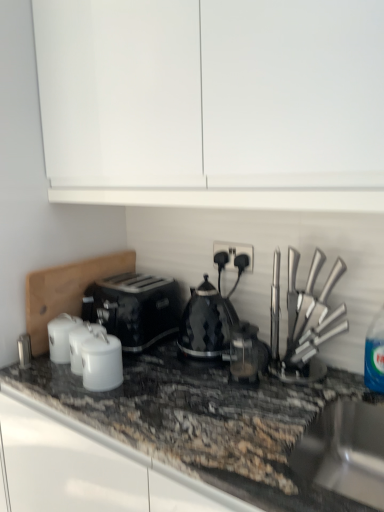
Question: Is satin black coffee machine at center located within white glossy canisters at center, the 1th kitchen appliance in the left-to-right sequence?

Choices:
 (A) no
 (B) yes

Answer: (A)

Question: Is white glossy canisters at center, the 1th kitchen appliance in the left-to-right sequence, oriented away from satin black coffee machine at center?

Choices:
 (A) yes
 (B) no

Answer: (B)

Question: Is white glossy canisters at center, the 1th kitchen appliance in the left-to-right sequence, aimed at satin black coffee machine at center?

Choices:
 (A) yes
 (B) no

Answer: (B)

Question: Is there a large distance between white glossy canisters at center, the 1th kitchen appliance in the left-to-right sequence, and satin black coffee machine at center?

Choices:
 (A) yes
 (B) no

Answer: (B)

Question: Does white glossy canisters at center, the 1th kitchen appliance in the left-to-right sequence, have a smaller size compared to satin black coffee machine at center?

Choices:
 (A) yes
 (B) no

Answer: (A)

Question: From a real-world perspective, is white glossy canister at center, which is the second kitchen appliance from left to right, above or below black plastic socket at center?

Choices:
 (A) above
 (B) below

Answer: (B)

Question: Is white glossy canister at center, which is the second kitchen appliance from left to right, wider or thinner than black plastic socket at center?

Choices:
 (A) wide
 (B) thin

Answer: (A)

Question: From the image's perspective, relative to black plastic socket at center, is white glossy canister at center, which appears as the third kitchen appliance when viewed from the right, above or below?

Choices:
 (A) below
 (B) above

Answer: (A)

Question: Considering the positions of white glossy canister at center, which is the second kitchen appliance from left to right, and black plastic socket at center in the image, is white glossy canister at center, which is the second kitchen appliance from left to right, bigger or smaller than black plastic socket at center?

Choices:
 (A) big
 (B) small

Answer: (A)

Question: In the image, is blue plastic bottle at right on the left side or the right side of stainless steel sink at lower right?

Choices:
 (A) left
 (B) right

Answer: (B)

Question: From a real-world perspective, is blue plastic bottle at right positioned above or below stainless steel sink at lower right?

Choices:
 (A) above
 (B) below

Answer: (A)

Question: Considering the positions of blue plastic bottle at right and stainless steel sink at lower right in the image, is blue plastic bottle at right taller or shorter than stainless steel sink at lower right?

Choices:
 (A) tall
 (B) short

Answer: (A)

Question: In terms of width, does blue plastic bottle at right look wider or thinner when compared to stainless steel sink at lower right?

Choices:
 (A) wide
 (B) thin

Answer: (B)

Question: In terms of size, does blue plastic bottle at right appear bigger or smaller than black diamond-patterned kettle at center, placed as the 2th kitchen appliance when sorted from right to left?

Choices:
 (A) big
 (B) small

Answer: (B)

Question: From the image's perspective, is blue plastic bottle at right above or below black diamond-patterned kettle at center, placed as the 2th kitchen appliance when sorted from right to left?

Choices:
 (A) below
 (B) above

Answer: (A)